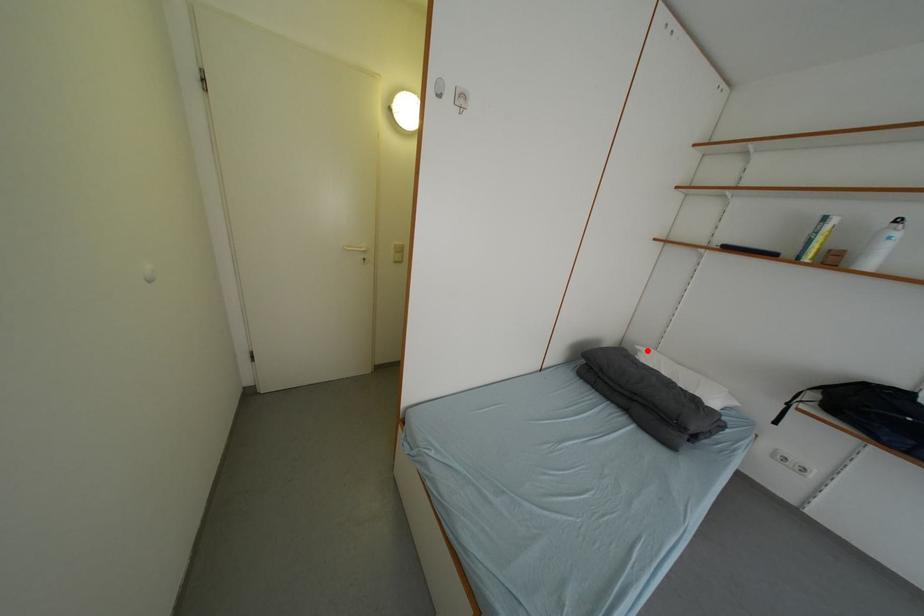
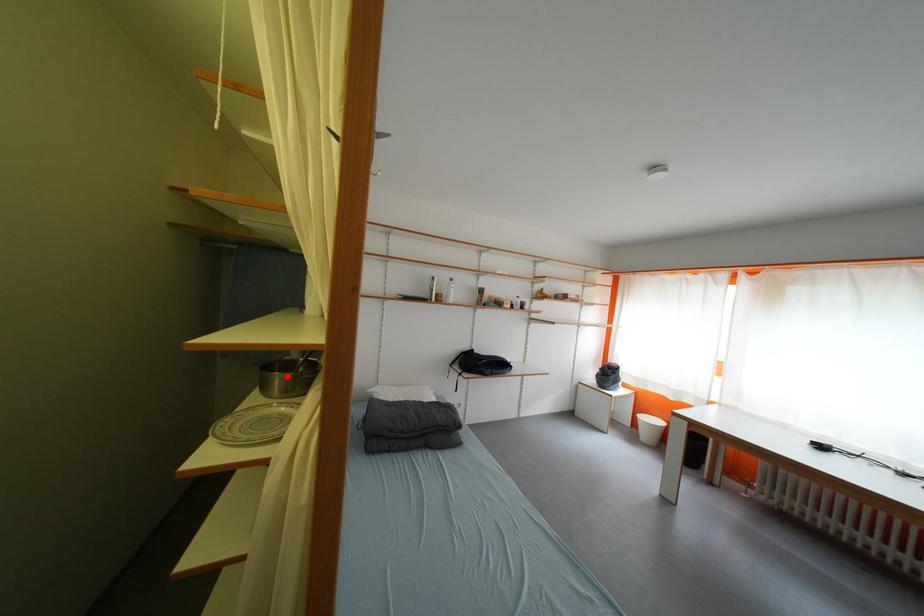
I am providing you with two images of the same scene from different viewpoints. A red point is marked on the first image and another point is marked on the second image. Are the points marked in image1 and image2 representing the same 3D position?

No